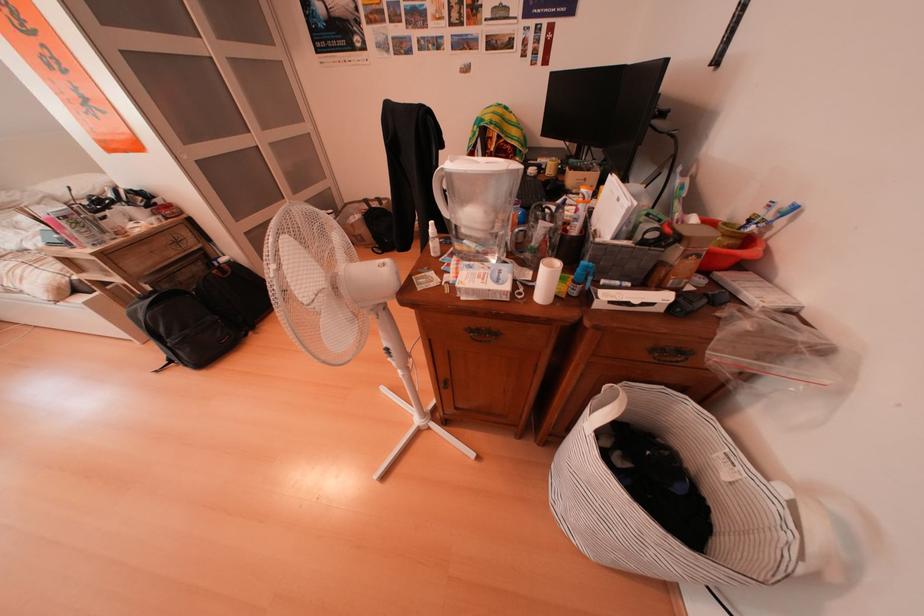
At what (x,y) coordinates should I click in order to perform the action: click on white spray nozzle. Please return your answer as a coordinate pair (x, y). Looking at the image, I should click on (x=432, y=232).